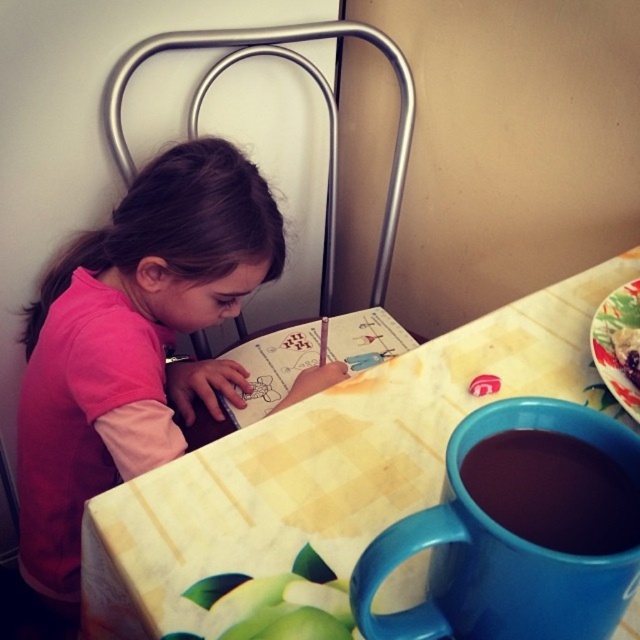
Does blue glossy mug at lower right have a greater height compared to dark matte mug at lower right?

Yes.

Does blue glossy mug at lower right have a smaller size compared to dark matte mug at lower right?

No.

Is point (448, 468) more distant than point (528, 438)?

That is False.

Find the location of a particular element. This screenshot has height=640, width=640. blue glossy mug at lower right is located at coordinates (500, 548).

Is the position of yellow printed table at center more distant than that of dark matte mug at lower right?

Yes, it is behind dark matte mug at lower right.

Is yellow printed table at center thinner than dark matte mug at lower right?

No, yellow printed table at center is not thinner than dark matte mug at lower right.

Locate an element on the screen. yellow printed table at center is located at coordinates (326, 464).

Is point (502, 512) farther from camera compared to point (605, 321)?

That is False.

Can you confirm if dark matte mug at lower right is positioned below floral ceramic plate at upper right?

Correct, dark matte mug at lower right is located below floral ceramic plate at upper right.

Identify the location of dark matte mug at lower right. point(554,492).

What are the coordinates of `dark matte mug at lower right` in the screenshot? It's located at (554, 492).